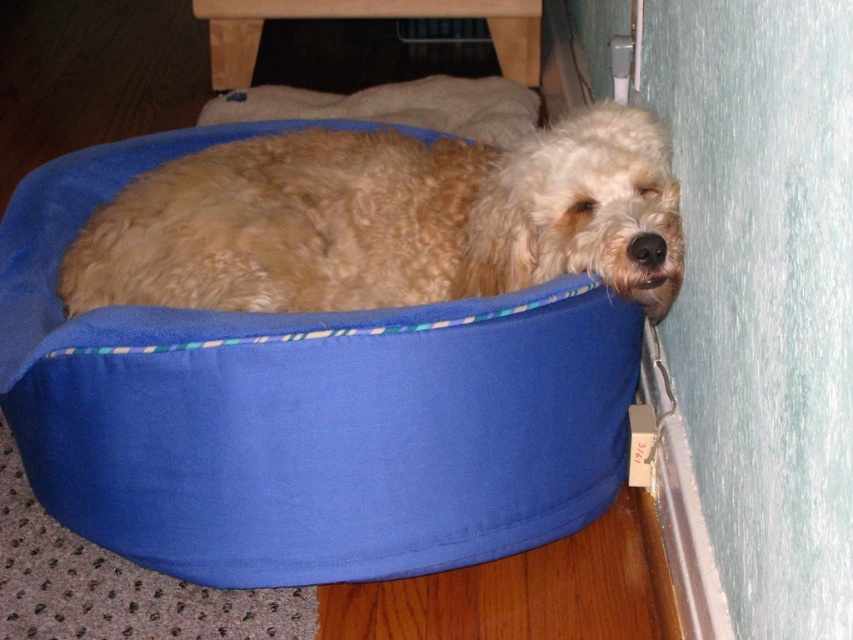
You are a dog owner who wants to move your fluffy golden dog at lower right to the living room. The path to the living room is behind the blue fabric dog bed at lower left. Can you move the dog without moving the bed first?

The blue fabric dog bed at lower left is in front of the fluffy golden dog at lower right, so you need to move the bed first to access the path behind it.

You are a pet owner who wants to buy a new dog bed for your fluffy golden dog at lower right. The store has a bed that is exactly the same size as the blue fabric dog bed at lower left. Will this new bed be big enough for your dog?

The blue fabric dog bed at lower left is wider than the fluffy golden dog at lower right, so the new bed will be big enough for the dog.